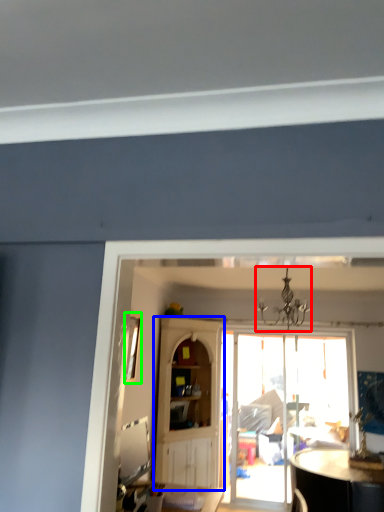
Question: Which is farther away from light fixture (highlighted by a red box)? cabinetry (highlighted by a blue box) or window (highlighted by a green box)?

Choices:
 (A) cabinetry
 (B) window

Answer: (A)